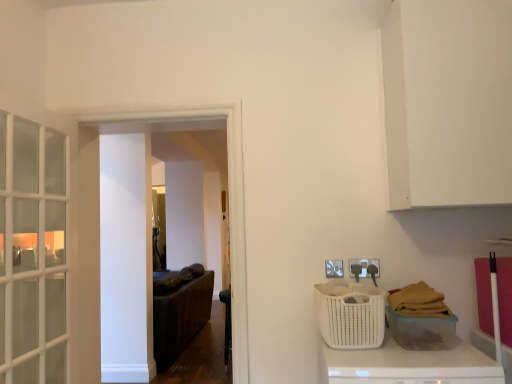
Question: Is black leather chair at center bigger or smaller than white matte counter top at lower right?

Choices:
 (A) big
 (B) small

Answer: (B)

Question: Is point (224, 332) closer or farther from the camera than point (426, 372)?

Choices:
 (A) farther
 (B) closer

Answer: (A)

Question: Which object is the closest to the white wicker basket at lower right, which is the first basket in right-to-left order?

Choices:
 (A) black leather chair at center
 (B) white matte counter top at lower right
 (C) white woven basket at lower right, which is the first basket in left-to-right order

Answer: (B)

Question: Which object is positioned closest to the white woven basket at lower right, the 2th basket viewed from the right?

Choices:
 (A) white matte counter top at lower right
 (B) white wicker basket at lower right, which is the first basket in right-to-left order
 (C) black leather chair at center

Answer: (A)